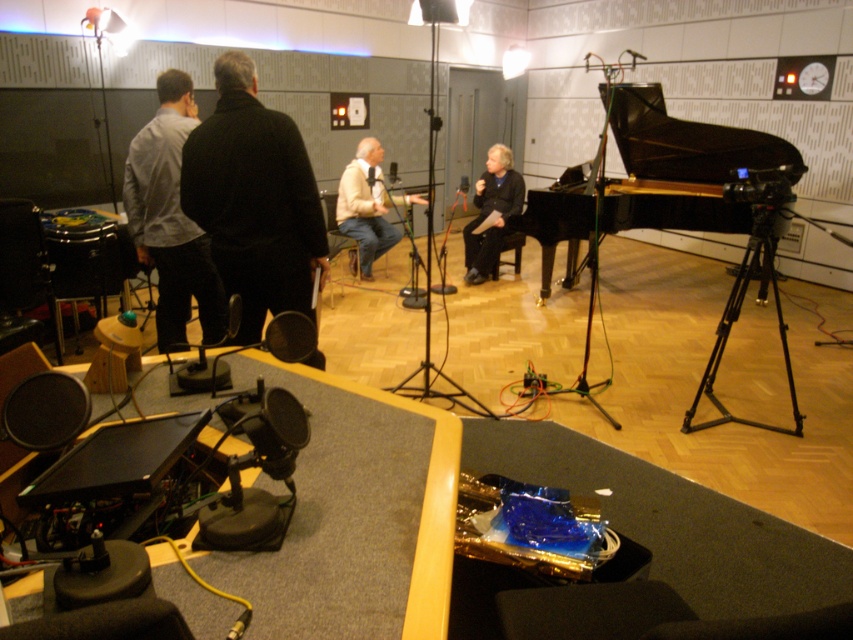
Does point (222, 244) come closer to viewer compared to point (616, 195)?

That is True.

Between black matte jacket at center and black polished piano at center, which one appears on the right side from the viewer's perspective?

Positioned to the right is black polished piano at center.

At what (x,y) coordinates should I click in order to perform the action: click on black matte jacket at center. Please return your answer as a coordinate pair (x, y). Looking at the image, I should click on (254, 198).

Does black polished piano at center have a smaller size compared to black metal tripod at right?

No, black polished piano at center is not smaller than black metal tripod at right.

Describe the element at coordinates (682, 164) in the screenshot. The image size is (853, 640). I see `black polished piano at center` at that location.

This screenshot has width=853, height=640. Find the location of `black polished piano at center`. black polished piano at center is located at coordinates (682, 164).

Can you confirm if black metal tripod at right is positioned above black matte tripod at center?

Correct, black metal tripod at right is located above black matte tripod at center.

Does black metal tripod at right have a greater height compared to black matte tripod at center?

Yes, black metal tripod at right is taller than black matte tripod at center.

Which is in front, point (764, 275) or point (433, 118)?

Point (433, 118) is in front.

Locate an element on the screen. black metal tripod at right is located at coordinates (735, 321).